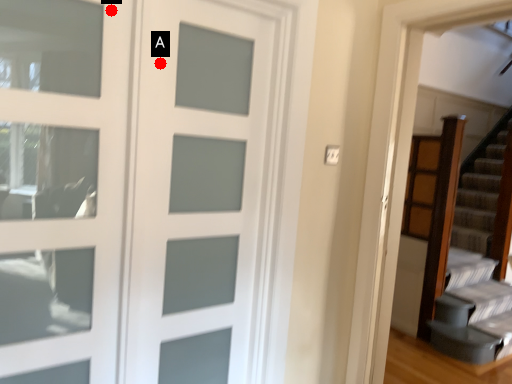
Question: Two points are circled on the image, labeled by A and B beside each circle. Which point is closer to the camera taking this photo?

Choices:
 (A) A is closer
 (B) B is closer

Answer: (B)